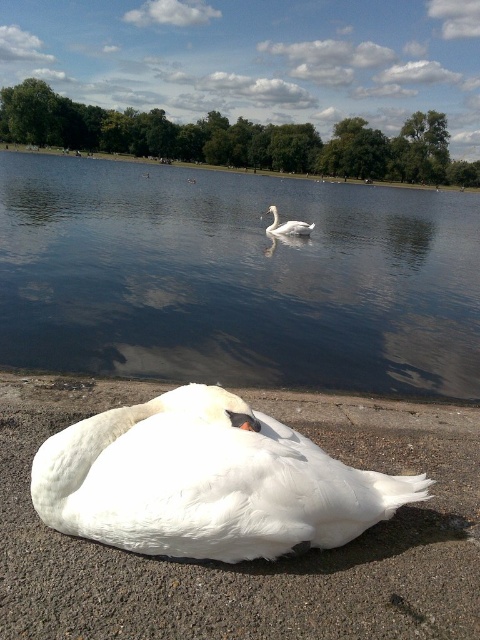
Question: Is glossy water at center thinner than gray concrete curb at lower center?

Choices:
 (A) yes
 (B) no

Answer: (B)

Question: Estimate the real-world distances between objects in this image. Which object is farther from the gray concrete curb at lower center?

Choices:
 (A) white feathered swan at lower center
 (B) white feathered swan at center

Answer: (B)

Question: Which of the following is the farthest from the observer?

Choices:
 (A) white feathered swan at center
 (B) gray concrete curb at lower center
 (C) glossy water at center
 (D) white feathered swan at lower center

Answer: (A)

Question: Among these objects, which one is farthest from the camera?

Choices:
 (A) gray concrete curb at lower center
 (B) glossy water at center
 (C) white feathered swan at lower center

Answer: (B)

Question: Does glossy water at center have a lesser width compared to white feathered swan at center?

Choices:
 (A) yes
 (B) no

Answer: (B)

Question: Can you confirm if glossy water at center is positioned to the right of white feathered swan at lower center?

Choices:
 (A) no
 (B) yes

Answer: (B)